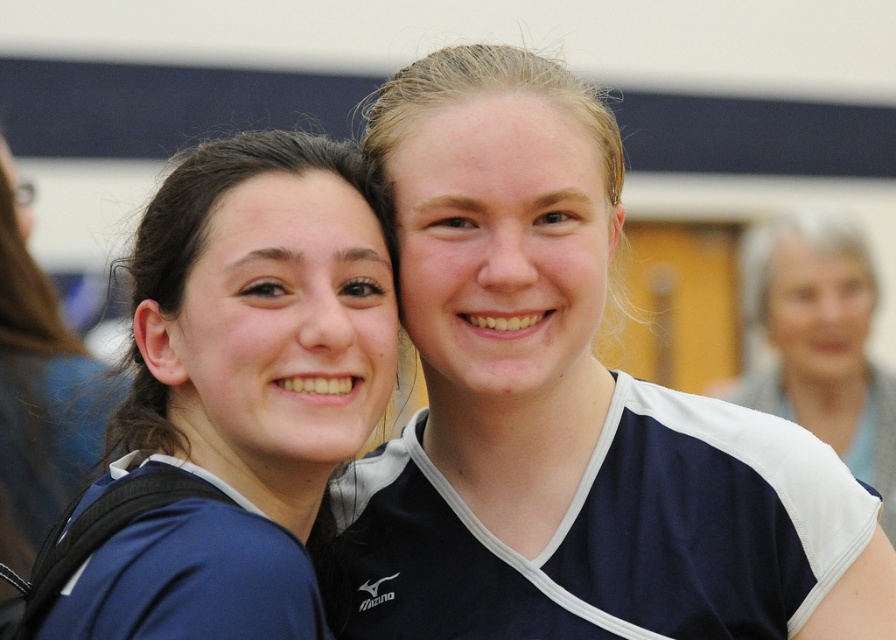
You are designing a team photo layout for a sports team. You have two jerseys to place in the frame. The blue jersey at upper right and the matte blue jersey at left. Which jersey should you place closer to the front of the photo to maintain the correct size relationship?

The blue jersey at upper right should be placed closer to the front of the photo because it is larger in size than the matte blue jersey at left.

You are a photographer at a sports event and need to capture a photo of both the blue jersey at left and the blue jersey at upper right. Based on their positions, which jersey is located to the left of the other?

The blue jersey at left is positioned on the left side of the blue jersey at upper right.